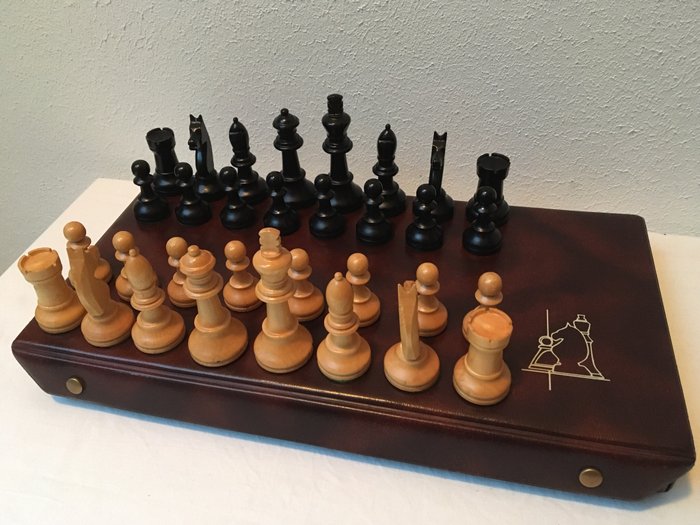
Identify the location of chess case. This screenshot has width=700, height=525. (631, 403).